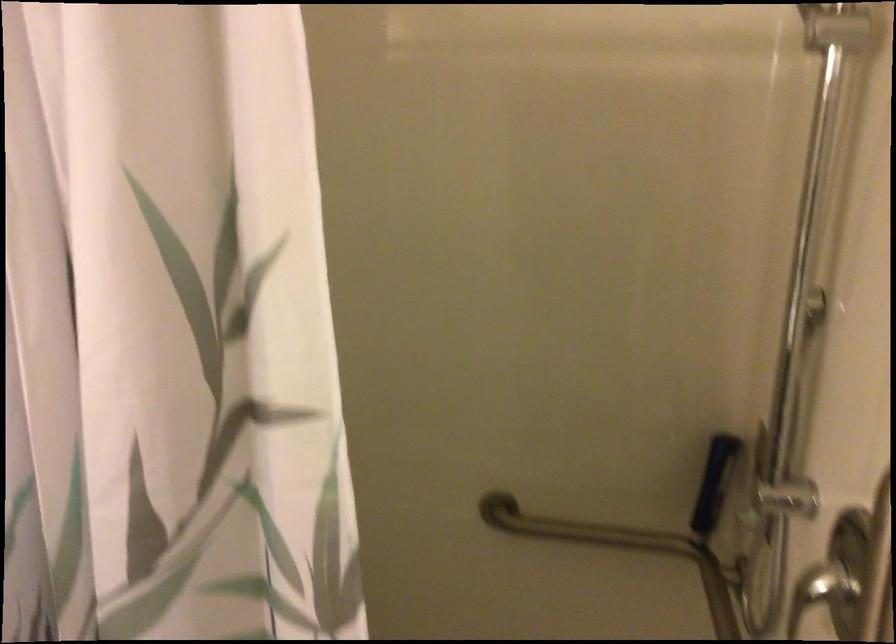
Find where to turn the shower faucet handle. Please return your answer as a coordinate pair (x, y).

(776, 488)